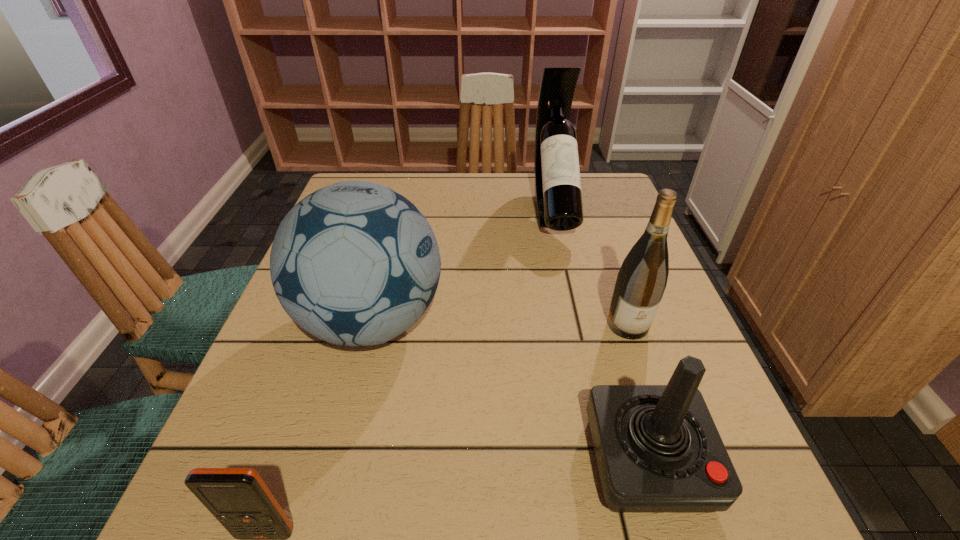
Where is `vacant area that lies between the second shortest object and the left wine bottle`? vacant area that lies between the second shortest object and the left wine bottle is located at coordinates tap(600, 334).

In order to click on unoccupied position between the farthest object and the right wine bottle in this screenshot , I will do `click(590, 267)`.

Point out which object is positioned as the third nearest to the second nearest object. Please provide its 2D coordinates. Your answer should be formatted as a tuple, i.e. [(x, y)], where the tuple contains the x and y coordinates of a point satisfying the conditions above.

[(238, 498)]

Point out which object is positioned as the fourth nearest to the second nearest object. Please provide its 2D coordinates. Your answer should be formatted as a tuple, i.e. [(x, y)], where the tuple contains the x and y coordinates of a point satisfying the conditions above.

[(558, 196)]